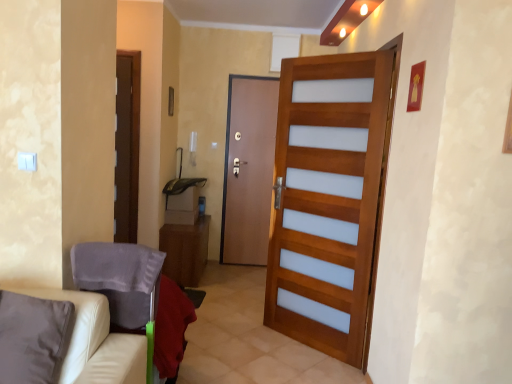
Question: From the image's perspective, is wooden door at center, the second door in the left-to-right sequence, located above beige leather couch at lower left?

Choices:
 (A) no
 (B) yes

Answer: (B)

Question: Can you confirm if wooden door at center, the second door in the left-to-right sequence, is thinner than beige leather couch at lower left?

Choices:
 (A) yes
 (B) no

Answer: (A)

Question: Does wooden door at center, the first door from the front, appear on the right side of beige leather couch at lower left?

Choices:
 (A) no
 (B) yes

Answer: (B)

Question: From the image's perspective, does wooden door at center, which appears as the 1th door when viewed from the right, appear lower than beige leather couch at lower left?

Choices:
 (A) yes
 (B) no

Answer: (B)

Question: Is beige leather couch at lower left a part of wooden door at center, the first door from the front?

Choices:
 (A) yes
 (B) no

Answer: (B)

Question: Is wooden door at center, which appears as the 1th door when viewed from the right, taller than beige leather couch at lower left?

Choices:
 (A) no
 (B) yes

Answer: (B)

Question: Does beige leather couch at lower left have a lesser height compared to brown wooden door at center, the second door viewed from the front?

Choices:
 (A) yes
 (B) no

Answer: (A)

Question: Is the surface of beige leather couch at lower left in direct contact with brown wooden door at center, which is the second door in right-to-left order?

Choices:
 (A) yes
 (B) no

Answer: (B)

Question: From a real-world perspective, is beige leather couch at lower left positioned over brown wooden door at center, positioned as the 1th door in left-to-right order, based on gravity?

Choices:
 (A) yes
 (B) no

Answer: (B)

Question: Does beige leather couch at lower left have a greater width compared to brown wooden door at center, the second door viewed from the front?

Choices:
 (A) yes
 (B) no

Answer: (A)

Question: From the image's perspective, does beige leather couch at lower left appear higher than brown wooden door at center, positioned as the 1th door in left-to-right order?

Choices:
 (A) yes
 (B) no

Answer: (B)

Question: Is beige leather couch at lower left taller than brown wooden door at center, the second door viewed from the front?

Choices:
 (A) yes
 (B) no

Answer: (B)

Question: Is beige leather couch at lower left aimed at white leather armchair at lower left?

Choices:
 (A) no
 (B) yes

Answer: (A)